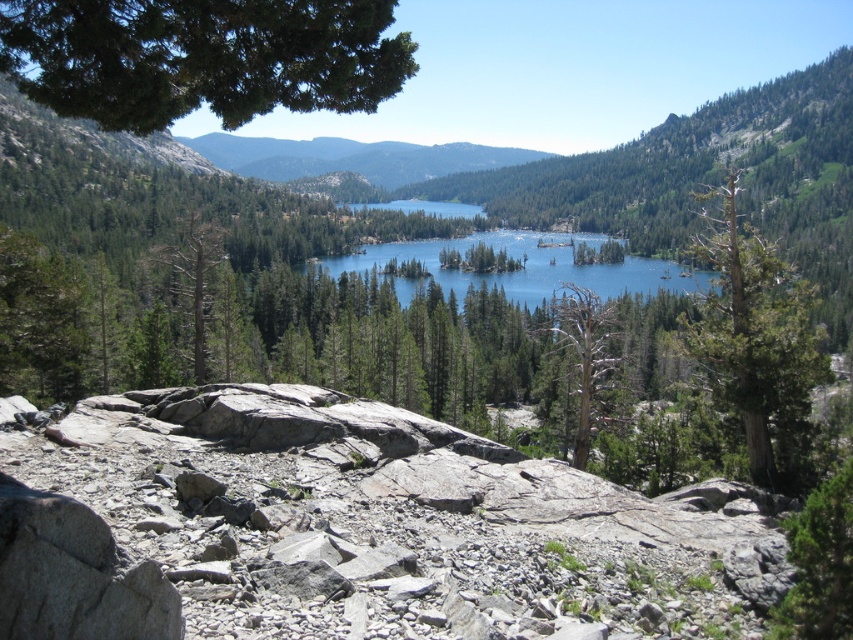
Question: Can you confirm if gray rock at center is positioned to the right of brown/dry wood tree at center?

Choices:
 (A) no
 (B) yes

Answer: (A)

Question: Among these objects, which one is farthest from the camera?

Choices:
 (A) brown/dry wood tree at center
 (B) green forested mountain at center
 (C) green leafy tree at upper left
 (D) green textured tree at center

Answer: (B)

Question: Is green leafy tree at upper left closer to the viewer compared to green forested mountain at center?

Choices:
 (A) yes
 (B) no

Answer: (A)

Question: Which object is closer to the camera taking this photo?

Choices:
 (A) green textured tree at center-right
 (B) green textured tree at center
 (C) green forested mountain at center
 (D) gray rock at center

Answer: (D)

Question: Which point is closer to the camera?

Choices:
 (A) green forested mountain at center
 (B) gray rock at center
 (C) brown/dry wood tree at center
 (D) green leafy tree at upper left

Answer: (B)

Question: Is green forested mountain at center wider than brown/dry wood tree at center?

Choices:
 (A) no
 (B) yes

Answer: (B)